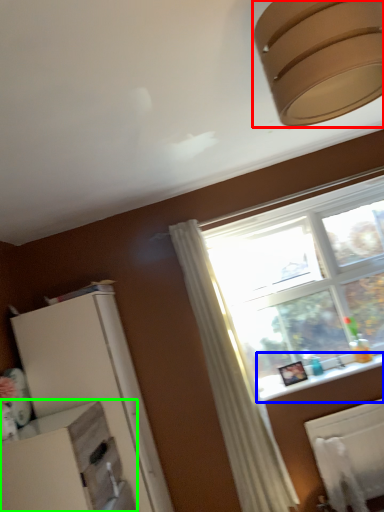
Question: Which object is the closest to the lamp (highlighted by a red box)? Choose among these: window sill (highlighted by a blue box) or dresser (highlighted by a green box).

Choices:
 (A) window sill
 (B) dresser

Answer: (B)